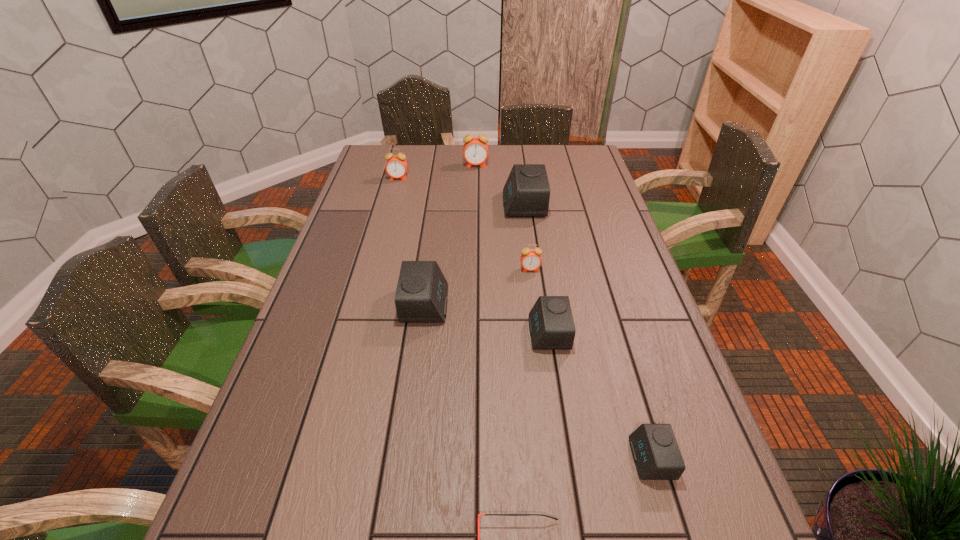
Image resolution: width=960 pixels, height=540 pixels. I want to click on vacant point located between the shortest alarm clock and the second farthest pink alarm clock, so click(x=525, y=319).

Find the location of a particular element. This screenshot has width=960, height=540. vacant region between the third biggest black alarm clock and the second nearest object is located at coordinates (600, 396).

Locate which object is the fourth closest to the seventh nearest object. Please provide its 2D coordinates. Your answer should be formatted as a tuple, i.e. [(x, y)], where the tuple contains the x and y coordinates of a point satisfying the conditions above.

[(531, 260)]

The image size is (960, 540). Find the location of `the fifth closest object relative to the red spectacles`. the fifth closest object relative to the red spectacles is located at coordinates (526, 193).

At what (x,y) coordinates should I click in order to perform the action: click on the second closest alarm clock to the biggest pink alarm clock. Please return your answer as a coordinate pair (x, y). This screenshot has height=540, width=960. Looking at the image, I should click on (396, 166).

Select which alarm clock is the fifth closest to the leftmost black alarm clock. Please provide its 2D coordinates. Your answer should be formatted as a tuple, i.e. [(x, y)], where the tuple contains the x and y coordinates of a point satisfying the conditions above.

[(396, 166)]

Choose which pink alarm clock is the nearest neighbor to the tallest alarm clock. Please provide its 2D coordinates. Your answer should be formatted as a tuple, i.e. [(x, y)], where the tuple contains the x and y coordinates of a point satisfying the conditions above.

[(396, 166)]

Identify which pink alarm clock is the nearest to the sixth alarm clock from right to left. Please provide its 2D coordinates. Your answer should be formatted as a tuple, i.e. [(x, y)], where the tuple contains the x and y coordinates of a point satisfying the conditions above.

[(531, 260)]

Locate an element on the screen. Image resolution: width=960 pixels, height=540 pixels. black alarm clock that can be found as the second closest to the third farthest alarm clock is located at coordinates (551, 324).

At what (x,y) coordinates should I click in order to perform the action: click on the closest black alarm clock to the third biggest black alarm clock. Please return your answer as a coordinate pair (x, y). Looking at the image, I should click on (421, 295).